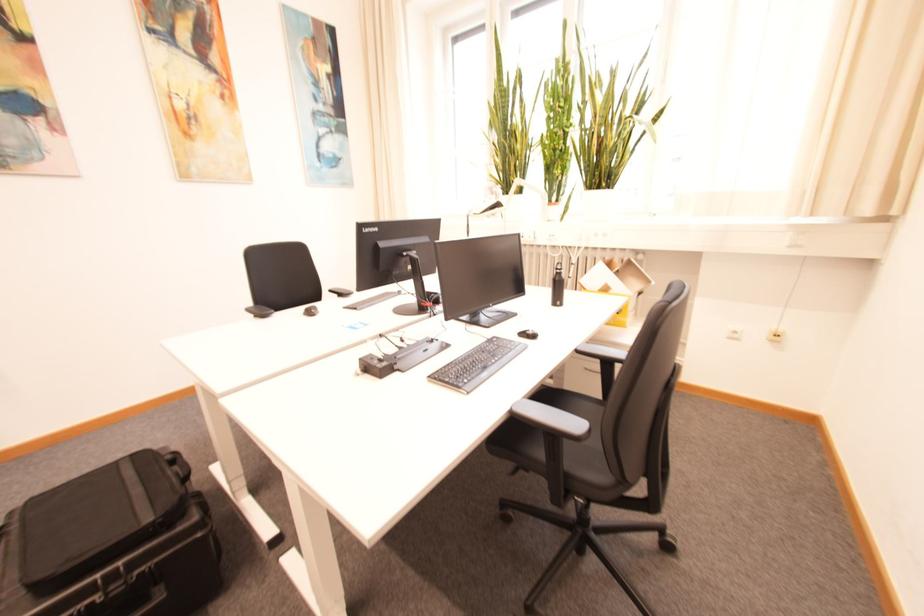
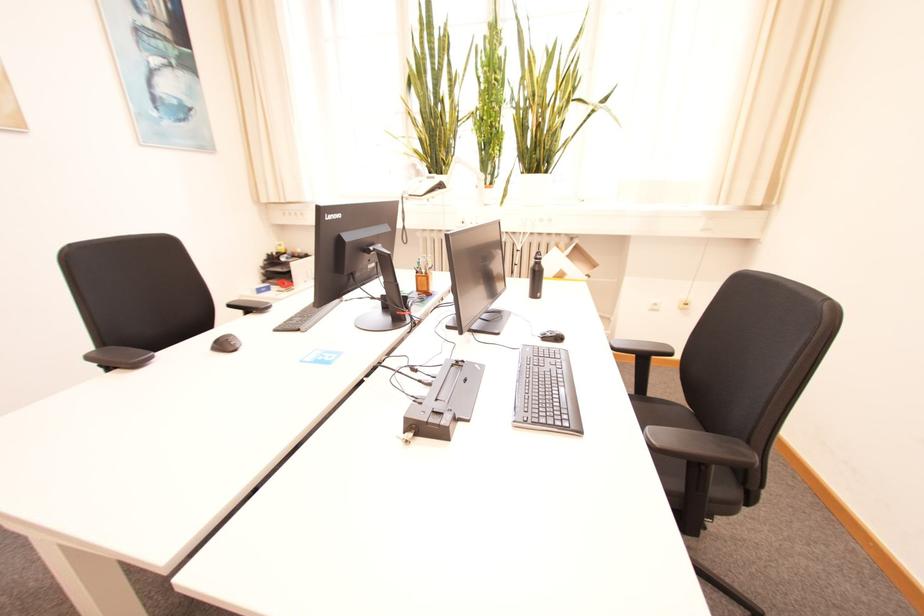
Where in the second image is the point corresponding to pixel 317 313 from the first image?

(229, 346)